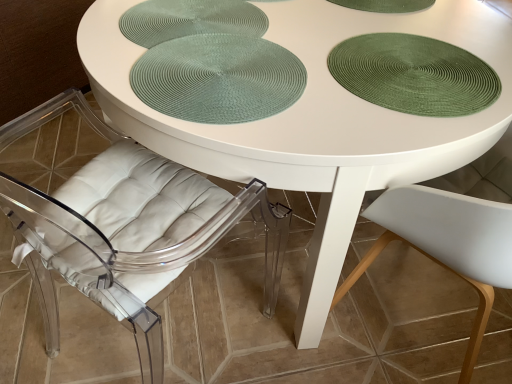
At what (x,y) coordinates should I click in order to perform the action: click on blank area beneath green woven placemat at upper center, which ranks as the 2th glass plate in right-to-left order (from a real-world perspective). Please return your answer as a coordinate pair (x, y). Looking at the image, I should click on (194, 30).